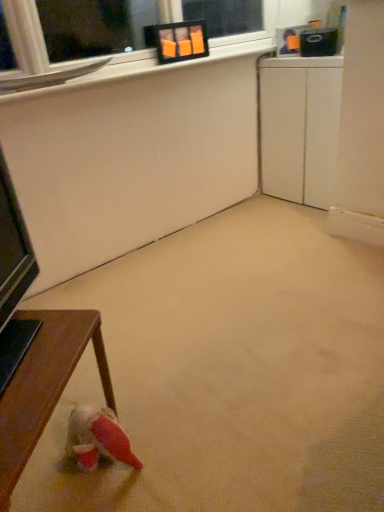
Question: In terms of width, does beige carpet at center look wider or thinner when compared to wooden table at lower left?

Choices:
 (A) wide
 (B) thin

Answer: (A)

Question: From the image's perspective, is beige carpet at center positioned above or below wooden table at lower left?

Choices:
 (A) above
 (B) below

Answer: (A)

Question: Which object is positioned closest to the beige carpet at center?

Choices:
 (A) white matte cabinet at right
 (B) wooden table at lower left

Answer: (B)

Question: Which is nearer to the wooden table at lower left?

Choices:
 (A) white matte cabinet at right
 (B) beige carpet at center

Answer: (B)